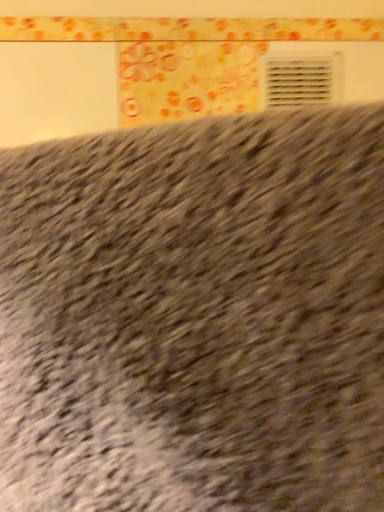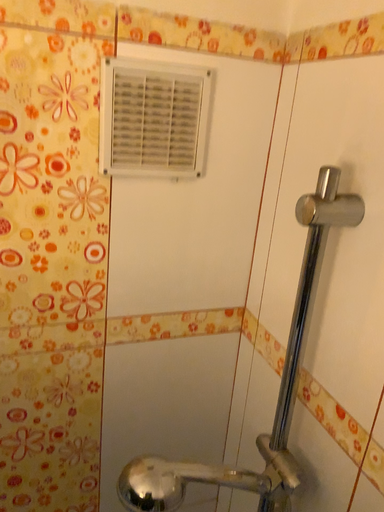
Question: Which way did the camera rotate in the video?

Choices:
 (A) rotated left
 (B) rotated right

Answer: (B)